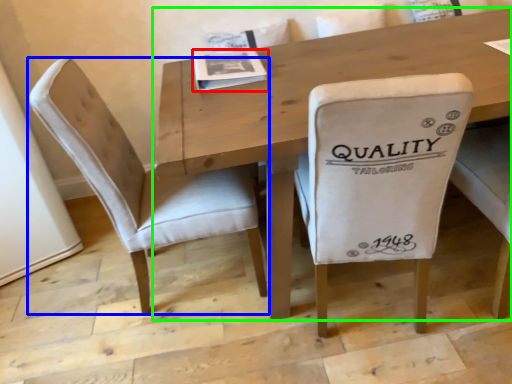
Question: Which is farther away from magazine (highlighted by a red box)? chair (highlighted by a blue box) or table (highlighted by a green box)?

Choices:
 (A) chair
 (B) table

Answer: (A)